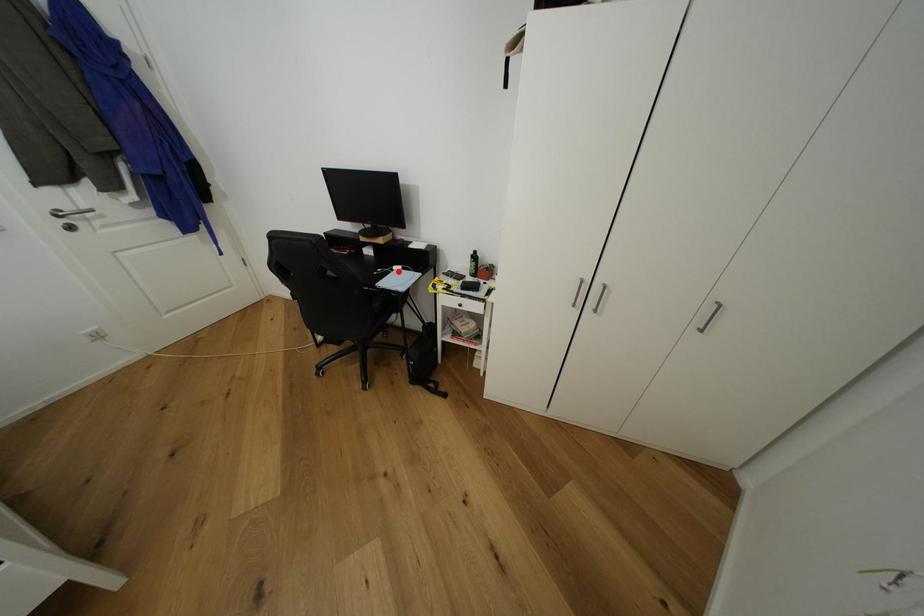
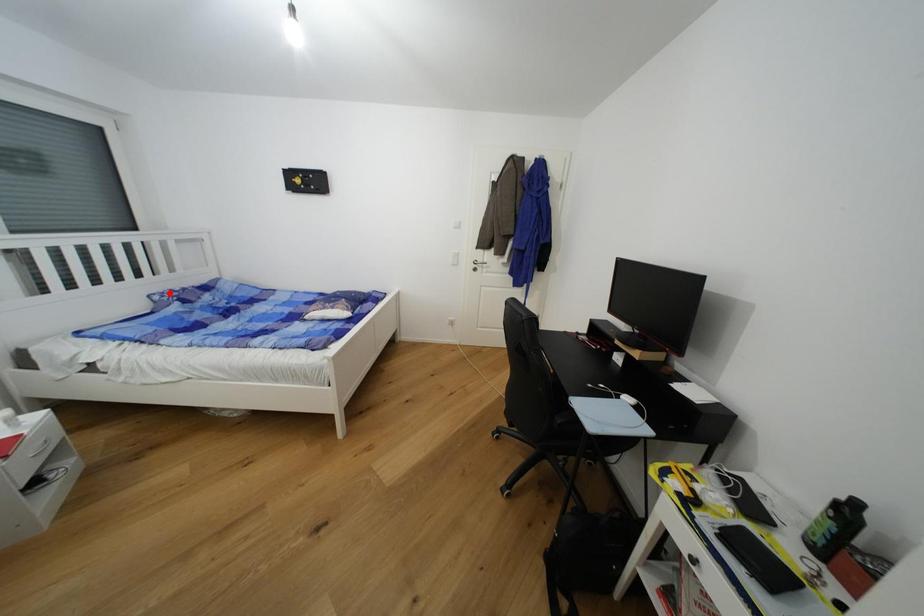
I am providing you with two images of the same scene from different viewpoints. A red point is marked on the first image and another point is marked on the second image. Does the point marked in image1 correspond to the same location as the one in image2?

No